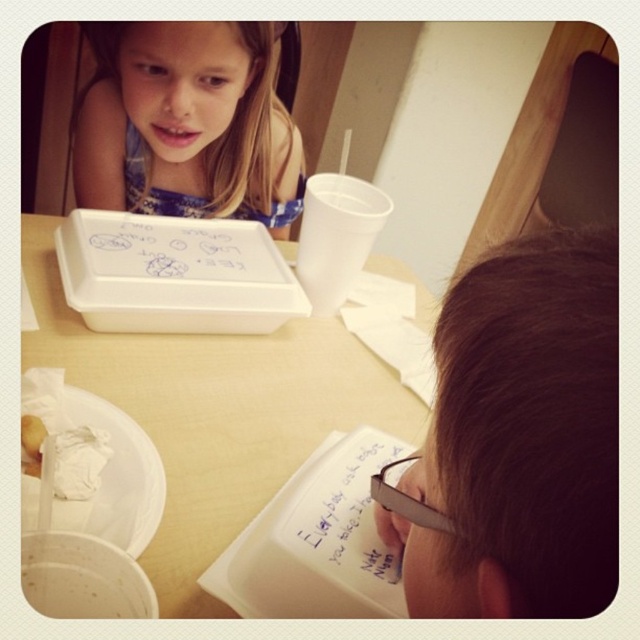
Is brown hair at upper right further to the viewer compared to white plastic tray at center?

That is False.

Locate an element on the screen. This screenshot has width=640, height=640. brown hair at upper right is located at coordinates (520, 438).

Where is `brown hair at upper right`? The height and width of the screenshot is (640, 640). brown hair at upper right is located at coordinates (520, 438).

Which is behind, point (579, 500) or point (93, 80)?

The point (93, 80) is more distant.

Does brown hair at upper right have a larger size compared to blonde hair at upper left?

Actually, brown hair at upper right might be smaller than blonde hair at upper left.

The image size is (640, 640). Find the location of `brown hair at upper right`. brown hair at upper right is located at coordinates (520, 438).

Locate an element on the screen. This screenshot has height=640, width=640. brown hair at upper right is located at coordinates point(520,438).

Is brown hair at upper right to the left of white paper at center from the viewer's perspective?

No, brown hair at upper right is not to the left of white paper at center.

Is brown hair at upper right to the right of white paper at center from the viewer's perspective?

Correct, you'll find brown hair at upper right to the right of white paper at center.

Is point (596, 467) farther from camera compared to point (346, 458)?

That is False.

You are a GUI agent. You are given a task and a screenshot of the screen. Output one action in this format:
    pyautogui.click(x=<x>, y=<y>)
    Task: Click on the brown hair at upper right
    This screenshot has width=640, height=640.
    Given the screenshot: What is the action you would take?
    pyautogui.click(x=520, y=438)